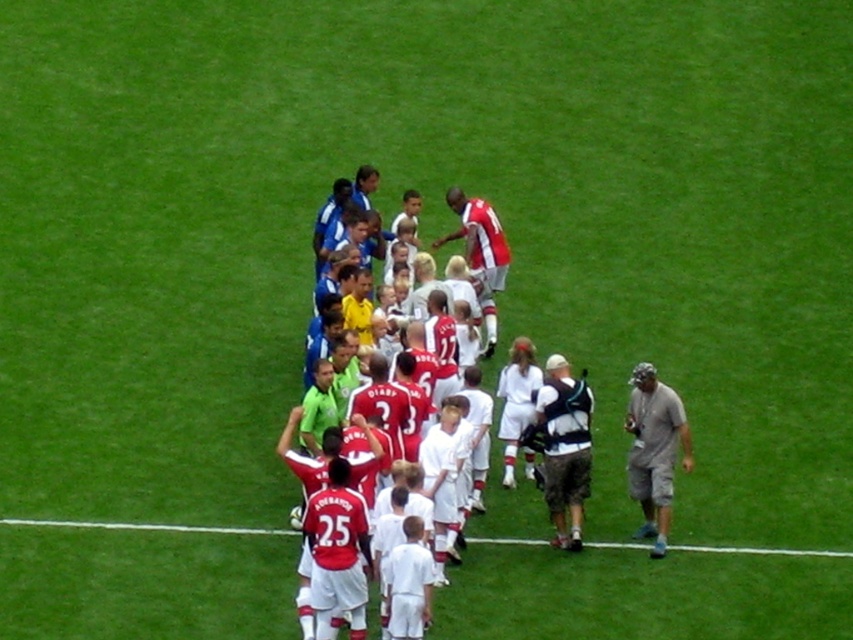
Which is more to the right, white mesh vest at center or matte red soccer jersey at center?

white mesh vest at center

Based on the photo, between white mesh vest at center and matte red soccer jersey at center, which one has more height?

Standing taller between the two is matte red soccer jersey at center.

Measure the distance between point (576,474) and camera.

Point (576,474) and camera are 61.95 feet apart from each other.

You are a GUI agent. You are given a task and a screenshot of the screen. Output one action in this format:
    pyautogui.click(x=<x>, y=<y>)
    Task: Click on the white mesh vest at center
    The width and height of the screenshot is (853, 640).
    Given the screenshot: What is the action you would take?
    pyautogui.click(x=564, y=448)

Is white mesh vest at center smaller than white fabric at lower center?

No, white mesh vest at center is not smaller than white fabric at lower center.

Is point (590, 465) positioned in front of point (531, 545)?

No, it is behind (531, 545).

Where is `white mesh vest at center`? The height and width of the screenshot is (640, 853). white mesh vest at center is located at coordinates (564, 448).

I want to click on white mesh vest at center, so click(x=564, y=448).

Which is behind, point (689, 461) or point (238, 528)?

Positioned behind is point (689, 461).

Which is behind, point (643, 438) or point (111, 529)?

The point (643, 438) is behind.

You are a GUI agent. You are given a task and a screenshot of the screen. Output one action in this format:
    pyautogui.click(x=<x>, y=<y>)
    Task: Click on the gray fabric cap at lower right
    
    Given the screenshot: What is the action you would take?
    pyautogui.click(x=654, y=451)